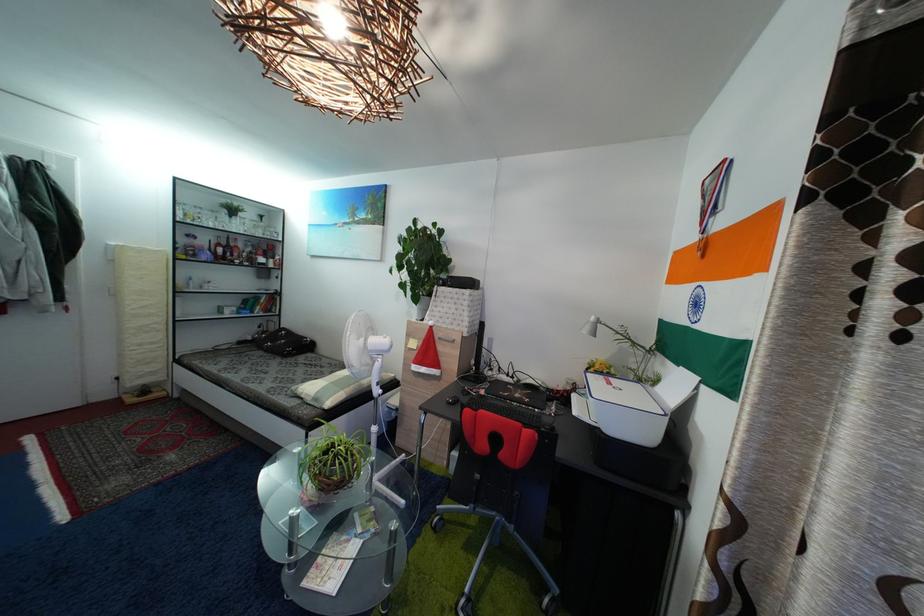
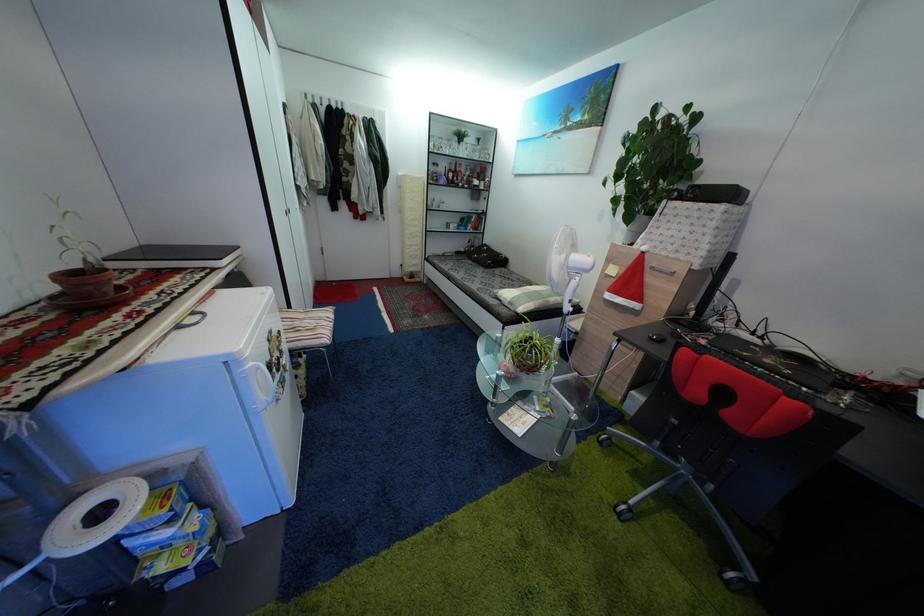
Find the pixel in the second image that matches pixel 322 407 in the first image.

(517, 310)